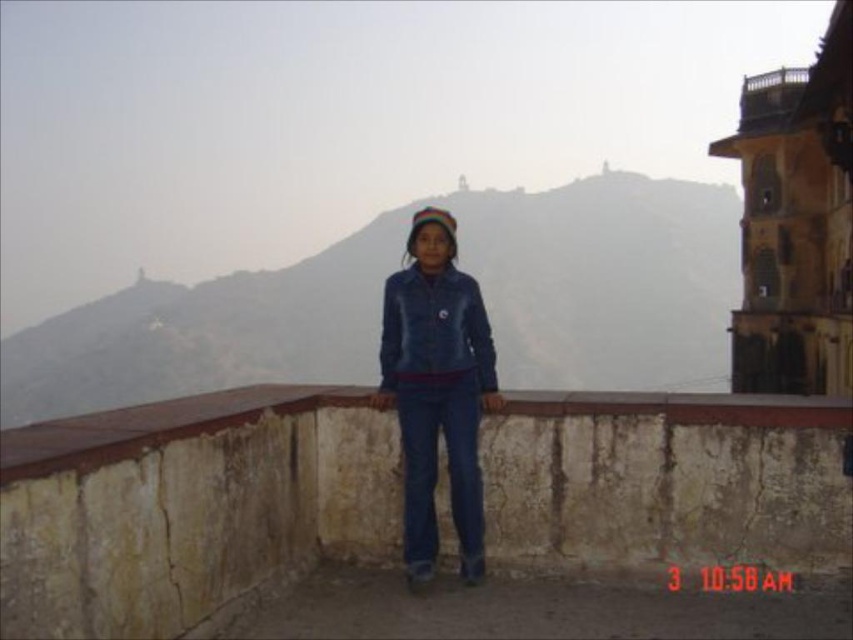
Question: Does foggy stone mountain at upper center come behind wooden railing at upper right?

Choices:
 (A) yes
 (B) no

Answer: (A)

Question: Does rustic stone ledge at center appear on the right side of denim jacket at center?

Choices:
 (A) yes
 (B) no

Answer: (A)

Question: Which point is closer to the camera taking this photo?

Choices:
 (A) (440, 500)
 (B) (755, 115)
 (C) (548, 304)
 (D) (456, 490)

Answer: (D)

Question: Which of the following is the farthest from the observer?

Choices:
 (A) foggy stone mountain at upper center
 (B) rustic stone ledge at center

Answer: (A)

Question: Which point appears closest to the camera in this image?

Choices:
 (A) [x=463, y=280]
 (B) [x=396, y=257]
 (C) [x=753, y=100]

Answer: (A)

Question: Does rustic stone ledge at center have a lesser width compared to denim jacket at center?

Choices:
 (A) yes
 (B) no

Answer: (B)